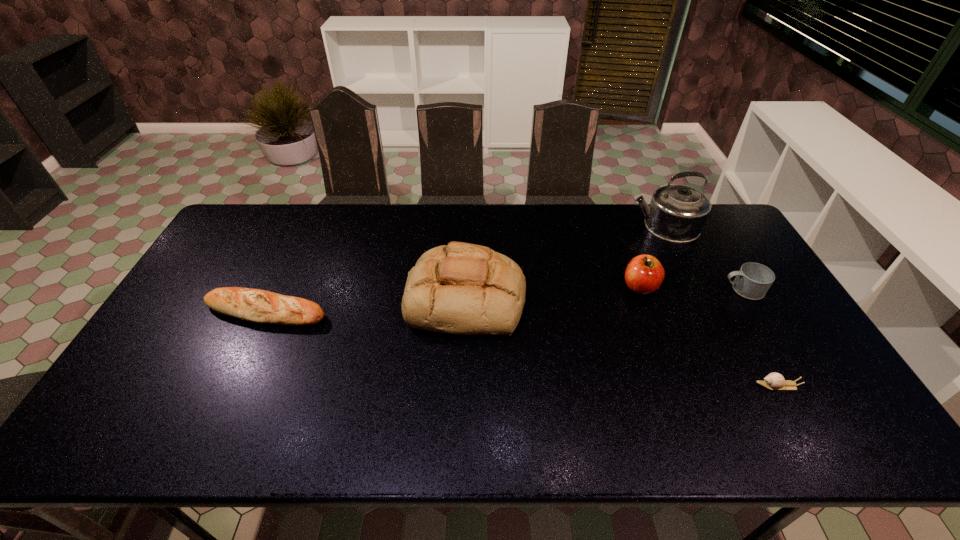
The image size is (960, 540). Identify the location of kettle. (677, 213).

The height and width of the screenshot is (540, 960). I want to click on the tallest object, so click(677, 213).

Locate an element on the screen. This screenshot has width=960, height=540. bread is located at coordinates (461, 288).

This screenshot has width=960, height=540. Find the location of `the fifth shortest object`. the fifth shortest object is located at coordinates (461, 288).

Find the location of a particular element. The image size is (960, 540). apple is located at coordinates (644, 274).

Find the location of a particular element. The width and height of the screenshot is (960, 540). mug is located at coordinates (753, 280).

Image resolution: width=960 pixels, height=540 pixels. What are the coordinates of `baguet` in the screenshot? It's located at (254, 305).

Find the location of a particular element. This screenshot has width=960, height=540. the shortest object is located at coordinates (774, 381).

This screenshot has width=960, height=540. Find the location of `escargot`. escargot is located at coordinates (774, 381).

Where is `free space located 0.250m with the spout at the front of the tallest object`? free space located 0.250m with the spout at the front of the tallest object is located at coordinates (558, 226).